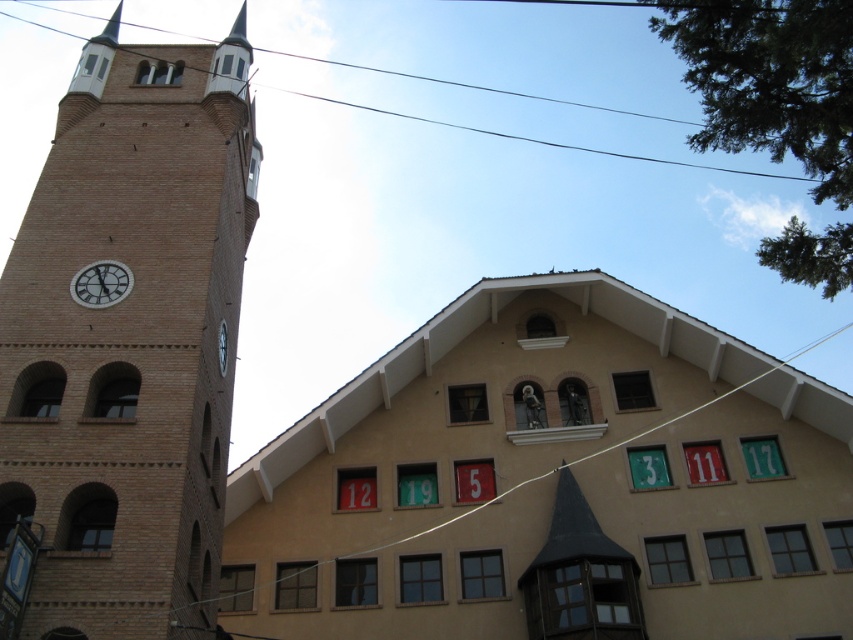
Question: From the image, what is the correct spatial relationship of brick tower at left in relation to white glossy clock at upper left?

Choices:
 (A) below
 (B) above

Answer: (B)

Question: Can you confirm if beige matte building at center is positioned above brick tower at left?

Choices:
 (A) no
 (B) yes

Answer: (A)

Question: Based on their relative distances, which object is farther from the brick tower at left?

Choices:
 (A) white glossy clock at upper left
 (B) matte brown clock at upper left

Answer: (B)

Question: Among these points, which one is nearest to the camera?

Choices:
 (A) (106, 292)
 (B) (618, 152)

Answer: (A)

Question: Which point appears farthest from the camera in this image?

Choices:
 (A) (712, 424)
 (B) (227, 333)
 (C) (86, 278)
 (D) (239, 51)

Answer: (D)

Question: Is beige matte building at center bigger than matte brown clock at upper left?

Choices:
 (A) no
 (B) yes

Answer: (B)